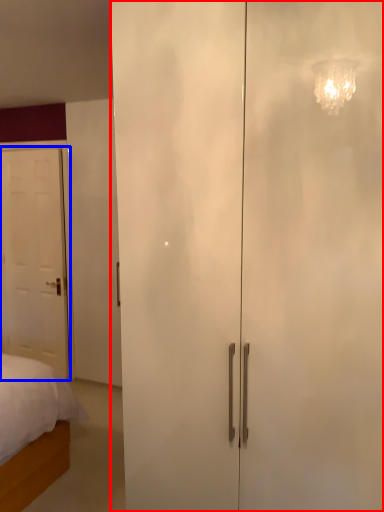
Question: Which of the following is the closest to the observer, door (highlighted by a red box) or door (highlighted by a blue box)?

Choices:
 (A) door
 (B) door

Answer: (A)